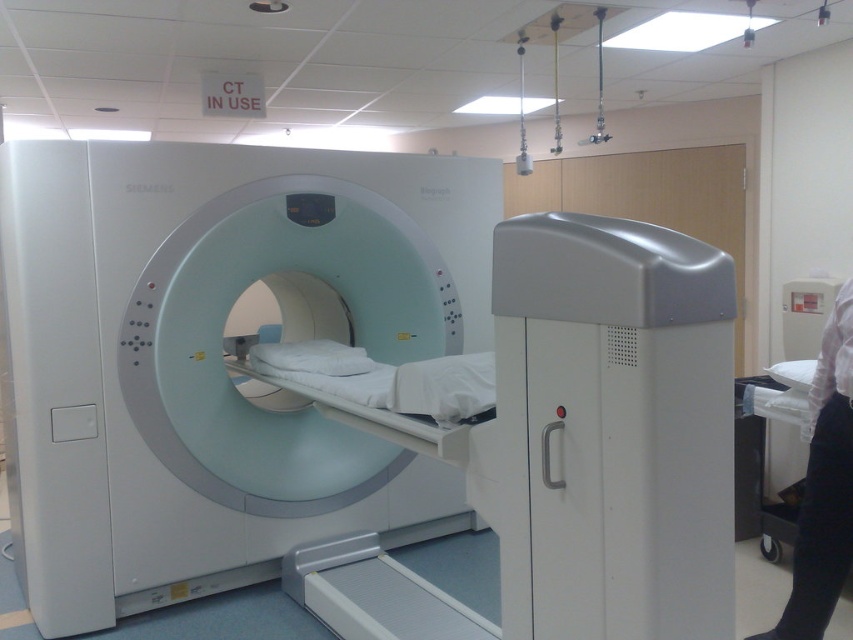
You are a patient who needs to lie down on the white glossy bed at center for a CT scan. The white plastic mri scanner at center is nearby. Which side of the bed should you position yourself on to be closest to the scanner?

The white plastic mri scanner at center is positioned on the left side of the white glossy bed at center, so you should position yourself on the left side of the white glossy bed at center to be closest to the scanner.

You are a nurse preparing to assist a patient onto the bed. Considering the height of the white plastic mri scanner at center and the white glossy bed at center, which one is easier for the patient to step onto?

The white glossy bed at center is easier to step onto because it is shorter than the white plastic mri scanner at center.

You are a patient who needs to enter the CT scanner. The nurse told you to lie down on the bed and align your head with the center of the scanner. According to the image, where should you position your head relative to the point marked as point (x=215, y=356)?

The point (x=215, y=356) marks the white plastic MRI scanner at center, so you should position your head directly at point (x=215, y=356) to align with the center of the scanner.